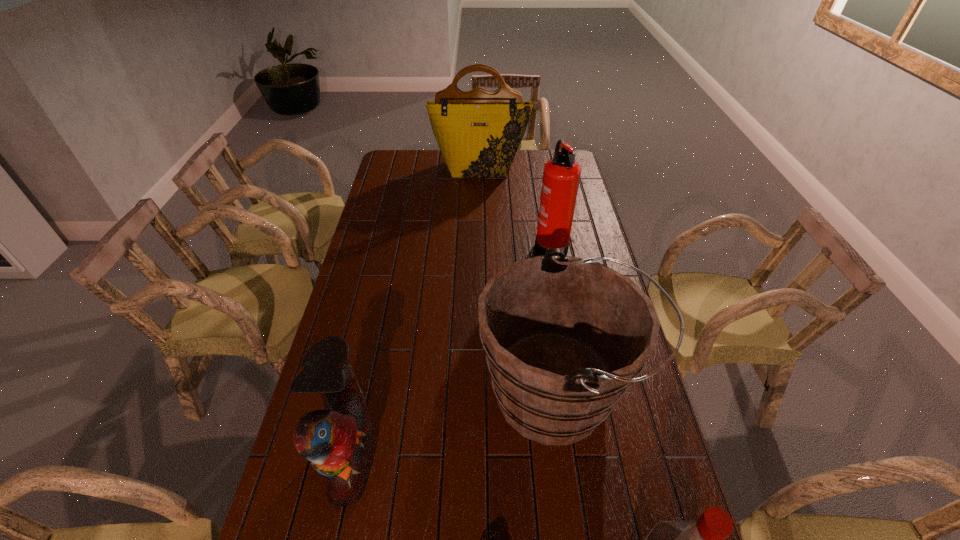
Where is `object that is at the left edge`? The width and height of the screenshot is (960, 540). object that is at the left edge is located at coordinates (337, 441).

The height and width of the screenshot is (540, 960). Find the location of `fire extinguisher that is positioned at the right edge`. fire extinguisher that is positioned at the right edge is located at coordinates (561, 175).

Find the location of a particular element. bucket that is at the right edge is located at coordinates (564, 337).

In order to click on vacant region at the left edge of the desktop in this screenshot , I will do `click(375, 286)`.

Find the location of `free space between the leftmost object and the farthest object`. free space between the leftmost object and the farthest object is located at coordinates (415, 313).

The height and width of the screenshot is (540, 960). I want to click on vacant area between the leftmost object and the second farthest object, so click(450, 350).

Select which object appears as the fifth closest to the parrot. Please provide its 2D coordinates. Your answer should be formatted as a tuple, i.e. [(x, y)], where the tuple contains the x and y coordinates of a point satisfying the conditions above.

[(478, 132)]

Identify the location of object that is the fourth closest to the fifth nearest object. The width and height of the screenshot is (960, 540). (704, 539).

Where is `free spot that satisfies the following two spatial constraints: 1. on the front-facing side of the farthest object; 2. at the face of the leftmost object`? The width and height of the screenshot is (960, 540). free spot that satisfies the following two spatial constraints: 1. on the front-facing side of the farthest object; 2. at the face of the leftmost object is located at coordinates (479, 457).